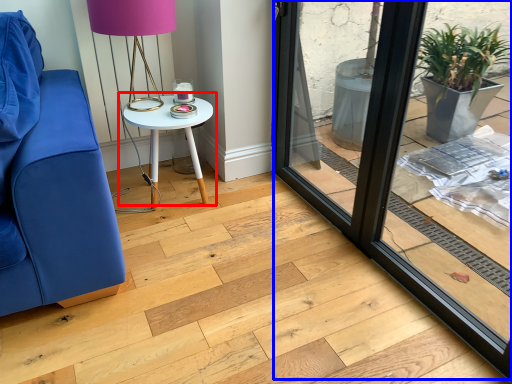
Question: Which object is closer to the camera taking this photo, table (highlighted by a red box) or window frame (highlighted by a blue box)?

Choices:
 (A) table
 (B) window frame

Answer: (B)